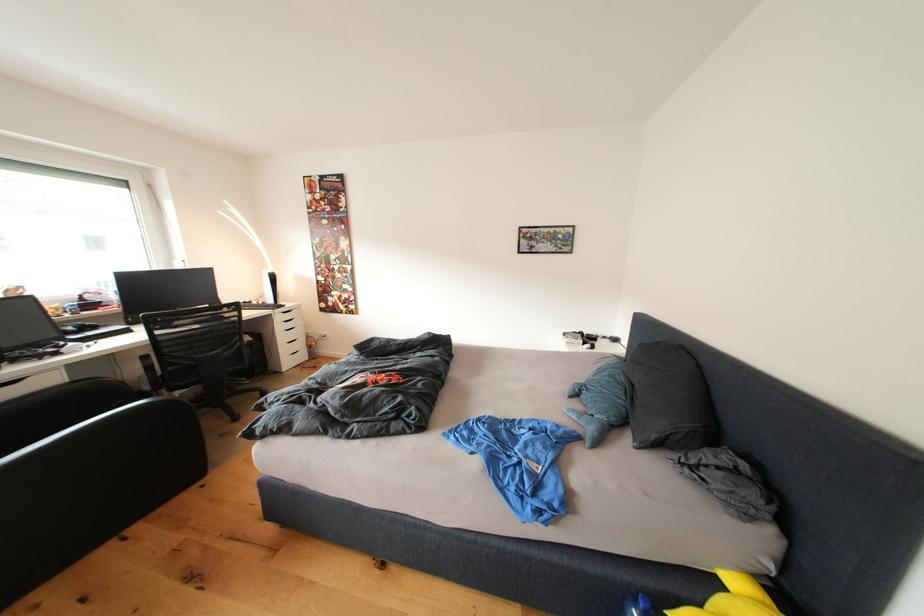
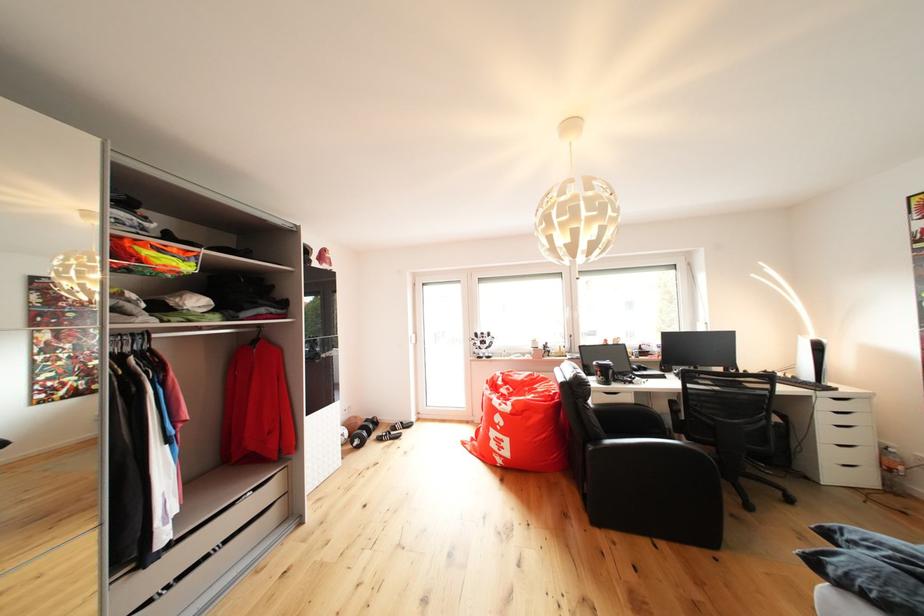
Find the pixel in the second image that matches pixel 307 339 in the first image.

(869, 444)